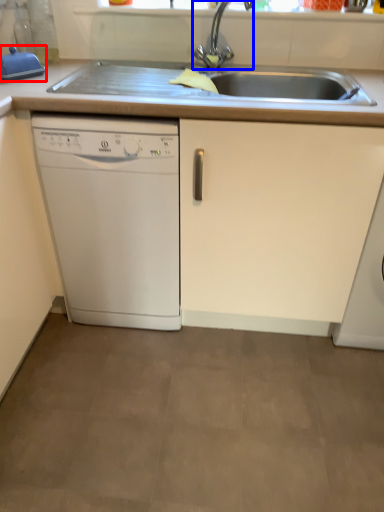
Question: Which object appears closest to the camera in this image, appliance (highlighted by a red box) or tap (highlighted by a blue box)?

Choices:
 (A) appliance
 (B) tap

Answer: (B)